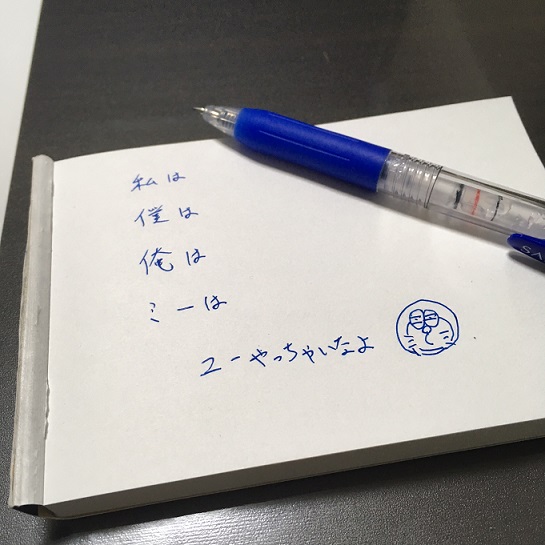
Find the location of a particular element. table is located at coordinates (319, 519), (18, 64).